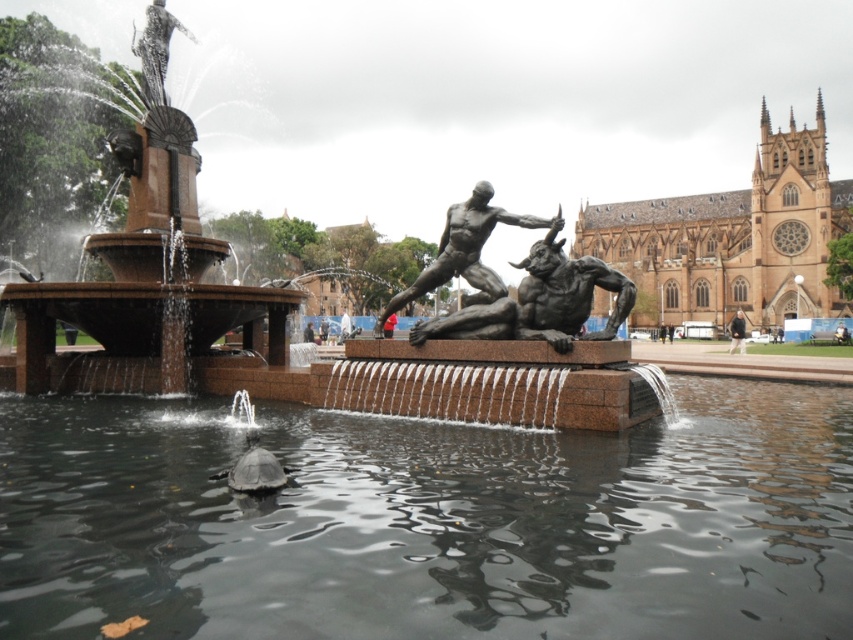
Question: Does dark gray water at center have a lesser width compared to bronze statue at center?

Choices:
 (A) no
 (B) yes

Answer: (A)

Question: Is dark gray water at center to the right of polished silver statue at upper left from the viewer's perspective?

Choices:
 (A) yes
 (B) no

Answer: (A)

Question: Which of the following is the closest to the observer?

Choices:
 (A) bronze/metallic figure at center
 (B) bronze statue at center

Answer: (A)

Question: Which of the following is the farthest from the observer?

Choices:
 (A) shiny black turtle at lower center
 (B) bronze statue at center
 (C) bronze/metallic figure at center
 (D) polished silver statue at upper left

Answer: (D)

Question: Among these points, which one is nearest to the camera?

Choices:
 (A) (476, 250)
 (B) (247, 440)

Answer: (B)

Question: Observing the image, what is the correct spatial positioning of dark gray water at center in reference to bronze statue at center?

Choices:
 (A) above
 (B) below

Answer: (B)